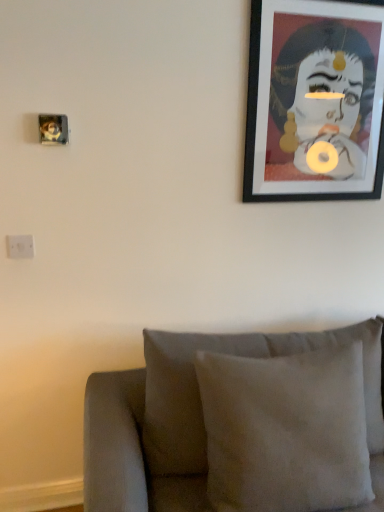
Question: Is point (8, 245) closer or farther from the camera than point (256, 198)?

Choices:
 (A) farther
 (B) closer

Answer: (B)

Question: Looking at the image, does white plastic electric outlet at left seem bigger or smaller compared to black matte picture frame at upper right?

Choices:
 (A) small
 (B) big

Answer: (A)

Question: Which object is the closest to the white plastic electric outlet at left?

Choices:
 (A) black matte picture frame at upper right
 (B) suede cushion at lower center

Answer: (B)

Question: Estimate the real-world distances between objects in this image. Which object is farther from the white plastic electric outlet at left?

Choices:
 (A) black matte picture frame at upper right
 (B) suede cushion at lower center

Answer: (A)